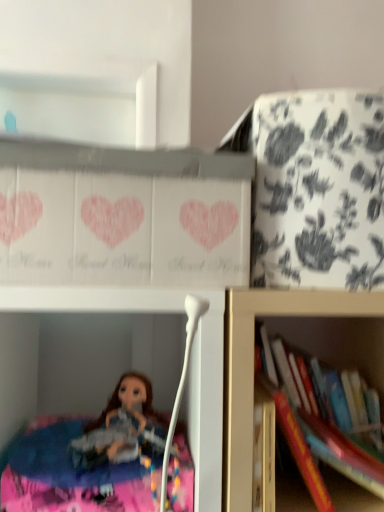
Measure the distance between point [291,402] and camera.

They are 29.33 inches apart.

How much space does white floral-patterned cabinet at upper right, positioned as the first cabinet in right-to-left order, occupy horizontally?

8.29 inches.

Where is `white cardboard box at upper center, which is counted as the first cabinet, starting from the left`? This screenshot has width=384, height=512. white cardboard box at upper center, which is counted as the first cabinet, starting from the left is located at coordinates pyautogui.click(x=128, y=213).

Can you confirm if white floral-patterned cabinet at upper right, positioned as the first cabinet in right-to-left order, is smaller than hardcover book at right, arranged as the second book when viewed from the front?

Actually, white floral-patterned cabinet at upper right, positioned as the first cabinet in right-to-left order, might be larger than hardcover book at right, arranged as the second book when viewed from the front.

Is point (228, 133) farther from viewer compared to point (326, 462)?

Yes, it is behind point (326, 462).

Is hardcover book at right, arranged as the second book when viewed from the front, touching white floral-patterned cabinet at upper right, positioned as the 2th cabinet in left-to-right order?

No, hardcover book at right, arranged as the second book when viewed from the front, is not touching white floral-patterned cabinet at upper right, positioned as the 2th cabinet in left-to-right order.

Which object is positioned more to the left, hardcover book at right, placed as the first book when sorted from back to front, or white floral-patterned cabinet at upper right, positioned as the 2th cabinet in left-to-right order?

Positioned to the left is white floral-patterned cabinet at upper right, positioned as the 2th cabinet in left-to-right order.

What's the angular difference between hardcover book at right, placed as the first book when sorted from back to front, and white floral-patterned cabinet at upper right, positioned as the first cabinet in right-to-left order,'s facing directions?

The angular difference between hardcover book at right, placed as the first book when sorted from back to front, and white floral-patterned cabinet at upper right, positioned as the first cabinet in right-to-left order, is 0.92 degrees.

Can you confirm if hardcover book at right, placed as the first book when sorted from back to front, is smaller than white floral-patterned cabinet at upper right, positioned as the 2th cabinet in left-to-right order?

Correct, hardcover book at right, placed as the first book when sorted from back to front, occupies less space than white floral-patterned cabinet at upper right, positioned as the 2th cabinet in left-to-right order.

Locate an element on the screen. This screenshot has width=384, height=512. book lying in front of the hardcover book at right, placed as the first book when sorted from back to front is located at coordinates coord(338,461).

Considering the sizes of objects hardcover book at right, placed as the first book when sorted from back to front, and hardcover book at lower right, acting as the 1th book starting from the front, in the image provided, who is wider, hardcover book at right, placed as the first book when sorted from back to front, or hardcover book at lower right, acting as the 1th book starting from the front,?

With larger width is hardcover book at lower right, acting as the 1th book starting from the front.

Which object is positioned more to the right, hardcover book at right, arranged as the second book when viewed from the front, or hardcover book at lower right, positioned as the 2th book in back-to-front order?

Positioned to the right is hardcover book at lower right, positioned as the 2th book in back-to-front order.

Considering the positions of objects hardcover book at right, arranged as the second book when viewed from the front, and white cardboard box at upper center, which is the 2th cabinet from right to left, in the image provided, who is more to the left, hardcover book at right, arranged as the second book when viewed from the front, or white cardboard box at upper center, which is the 2th cabinet from right to left,?

white cardboard box at upper center, which is the 2th cabinet from right to left, is more to the left.

Does hardcover book at right, placed as the first book when sorted from back to front, have a greater height compared to white cardboard box at upper center, which is counted as the first cabinet, starting from the left?

Correct, hardcover book at right, placed as the first book when sorted from back to front, is much taller as white cardboard box at upper center, which is counted as the first cabinet, starting from the left.

Starting from the white cardboard box at upper center, which is the 2th cabinet from right to left, which book is the 1st one to the right? Please provide its 2D coordinates.

[(320, 437)]

Considering their positions, is hardcover book at right, arranged as the second book when viewed from the front, located in front of or behind white cardboard box at upper center, which is counted as the first cabinet, starting from the left?

In the image, hardcover book at right, arranged as the second book when viewed from the front, appears behind white cardboard box at upper center, which is counted as the first cabinet, starting from the left.

Between hardcover book at lower right, acting as the 1th book starting from the front, and white floral-patterned cabinet at upper right, positioned as the 2th cabinet in left-to-right order, which one has smaller width?

hardcover book at lower right, acting as the 1th book starting from the front, is thinner.

Is the depth of hardcover book at lower right, positioned as the 2th book in back-to-front order, less than that of white floral-patterned cabinet at upper right, positioned as the first cabinet in right-to-left order?

Yes, it is.

Is hardcover book at lower right, acting as the 1th book starting from the front, shorter than white floral-patterned cabinet at upper right, positioned as the 2th cabinet in left-to-right order?

Yes, hardcover book at lower right, acting as the 1th book starting from the front, is shorter than white floral-patterned cabinet at upper right, positioned as the 2th cabinet in left-to-right order.

Is hardcover book at lower right, acting as the 1th book starting from the front, bigger than white floral-patterned cabinet at upper right, positioned as the 2th cabinet in left-to-right order?

Incorrect, hardcover book at lower right, acting as the 1th book starting from the front, is not larger than white floral-patterned cabinet at upper right, positioned as the 2th cabinet in left-to-right order.

In the scene shown: Which object is closer to the camera taking this photo, hardcover book at lower right, positioned as the 2th book in back-to-front order, or white cardboard box at upper center, which is the 2th cabinet from right to left?

white cardboard box at upper center, which is the 2th cabinet from right to left, is in front.

Is hardcover book at lower right, acting as the 1th book starting from the front, placed right next to white cardboard box at upper center, which is the 2th cabinet from right to left?

No, hardcover book at lower right, acting as the 1th book starting from the front, is not in contact with white cardboard box at upper center, which is the 2th cabinet from right to left.

Is hardcover book at lower right, acting as the 1th book starting from the front, oriented towards white cardboard box at upper center, which is the 2th cabinet from right to left?

No, hardcover book at lower right, acting as the 1th book starting from the front, is not aimed at white cardboard box at upper center, which is the 2th cabinet from right to left.

How different are the orientations of white cardboard box at upper center, which is counted as the first cabinet, starting from the left, and hardcover book at right, placed as the first book when sorted from back to front, in degrees?

1.06 degrees.

Is white cardboard box at upper center, which is the 2th cabinet from right to left, far from hardcover book at right, placed as the first book when sorted from back to front?

No, white cardboard box at upper center, which is the 2th cabinet from right to left, is not far from hardcover book at right, placed as the first book when sorted from back to front.

Between point (159, 270) and point (313, 444), which one is positioned in front?

Point (159, 270)

Is white cardboard box at upper center, which is the 2th cabinet from right to left, facing towards hardcover book at right, arranged as the second book when viewed from the front?

No.

Image resolution: width=384 pixels, height=512 pixels. I want to click on the 1st cabinet to the left of the hardcover book at right, placed as the first book when sorted from back to front, counting from the anchor's position, so click(x=315, y=188).

The height and width of the screenshot is (512, 384). There is a white floral-patterned cabinet at upper right, positioned as the 2th cabinet in left-to-right order. In order to click on the 1st book below it (from the image's perspective) in this screenshot , I will do `click(320, 437)`.

Estimate the real-world distances between objects in this image. Which object is closer to hardcover book at right, placed as the first book when sorted from back to front, hardcover book at lower right, positioned as the 2th book in back-to-front order, or white floral-patterned cabinet at upper right, positioned as the first cabinet in right-to-left order?

Among the two, hardcover book at lower right, positioned as the 2th book in back-to-front order, is located nearer to hardcover book at right, placed as the first book when sorted from back to front.

Considering their positions, is white cardboard box at upper center, which is the 2th cabinet from right to left, positioned closer to white floral-patterned cabinet at upper right, positioned as the first cabinet in right-to-left order, than hardcover book at right, arranged as the second book when viewed from the front?

The object closer to white floral-patterned cabinet at upper right, positioned as the first cabinet in right-to-left order, is white cardboard box at upper center, which is the 2th cabinet from right to left.

Estimate the real-world distances between objects in this image. Which object is closer to hardcover book at lower right, acting as the 1th book starting from the front, white floral-patterned cabinet at upper right, positioned as the first cabinet in right-to-left order, or white cardboard box at upper center, which is the 2th cabinet from right to left?

white floral-patterned cabinet at upper right, positioned as the first cabinet in right-to-left order, is positioned closer to the anchor hardcover book at lower right, acting as the 1th book starting from the front.

Looking at the image, which one is located closer to white cardboard box at upper center, which is counted as the first cabinet, starting from the left, hardcover book at lower right, acting as the 1th book starting from the front, or white floral-patterned cabinet at upper right, positioned as the 2th cabinet in left-to-right order?

The object closer to white cardboard box at upper center, which is counted as the first cabinet, starting from the left, is white floral-patterned cabinet at upper right, positioned as the 2th cabinet in left-to-right order.

When comparing their distances from hardcover book at lower right, positioned as the 2th book in back-to-front order, does white cardboard box at upper center, which is the 2th cabinet from right to left, or white floral-patterned cabinet at upper right, positioned as the 2th cabinet in left-to-right order, seem closer?

white floral-patterned cabinet at upper right, positioned as the 2th cabinet in left-to-right order, is closer to hardcover book at lower right, positioned as the 2th book in back-to-front order.

When comparing their distances from hardcover book at lower right, positioned as the 2th book in back-to-front order, does hardcover book at right, arranged as the second book when viewed from the front, or white cardboard box at upper center, which is the 2th cabinet from right to left, seem further?

white cardboard box at upper center, which is the 2th cabinet from right to left, is further to hardcover book at lower right, positioned as the 2th book in back-to-front order.

From the image, which object appears to be nearer to white floral-patterned cabinet at upper right, positioned as the 2th cabinet in left-to-right order, hardcover book at right, placed as the first book when sorted from back to front, or white cardboard box at upper center, which is counted as the first cabinet, starting from the left?

white cardboard box at upper center, which is counted as the first cabinet, starting from the left, is closer to white floral-patterned cabinet at upper right, positioned as the 2th cabinet in left-to-right order.

When comparing their distances from white cardboard box at upper center, which is the 2th cabinet from right to left, does hardcover book at right, placed as the first book when sorted from back to front, or white floral-patterned cabinet at upper right, positioned as the 2th cabinet in left-to-right order, seem further?

Based on the image, hardcover book at right, placed as the first book when sorted from back to front, appears to be further to white cardboard box at upper center, which is the 2th cabinet from right to left.

In order to click on cabinet between white floral-patterned cabinet at upper right, positioned as the first cabinet in right-to-left order, and hardcover book at right, placed as the first book when sorted from back to front, in the vertical direction in this screenshot , I will do `click(128, 213)`.

Locate an element on the screen. The image size is (384, 512). cabinet that lies between white floral-patterned cabinet at upper right, positioned as the first cabinet in right-to-left order, and hardcover book at lower right, positioned as the 2th book in back-to-front order, from top to bottom is located at coordinates (128, 213).

Locate an element on the screen. book between white floral-patterned cabinet at upper right, positioned as the first cabinet in right-to-left order, and hardcover book at lower right, positioned as the 2th book in back-to-front order, in the vertical direction is located at coordinates (320, 437).

Locate an element on the screen. The image size is (384, 512). book situated between white cardboard box at upper center, which is the 2th cabinet from right to left, and hardcover book at lower right, acting as the 1th book starting from the front, from left to right is located at coordinates [320, 437].